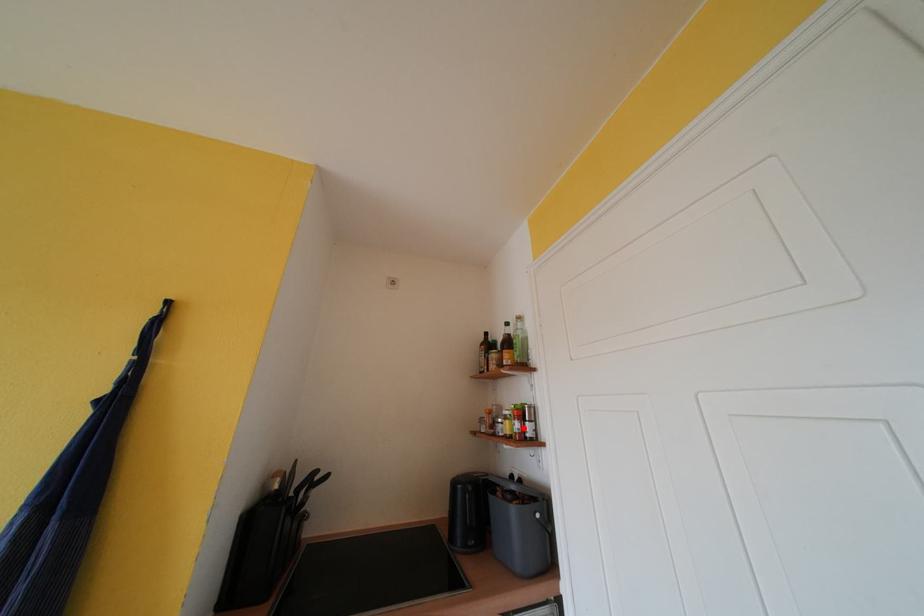
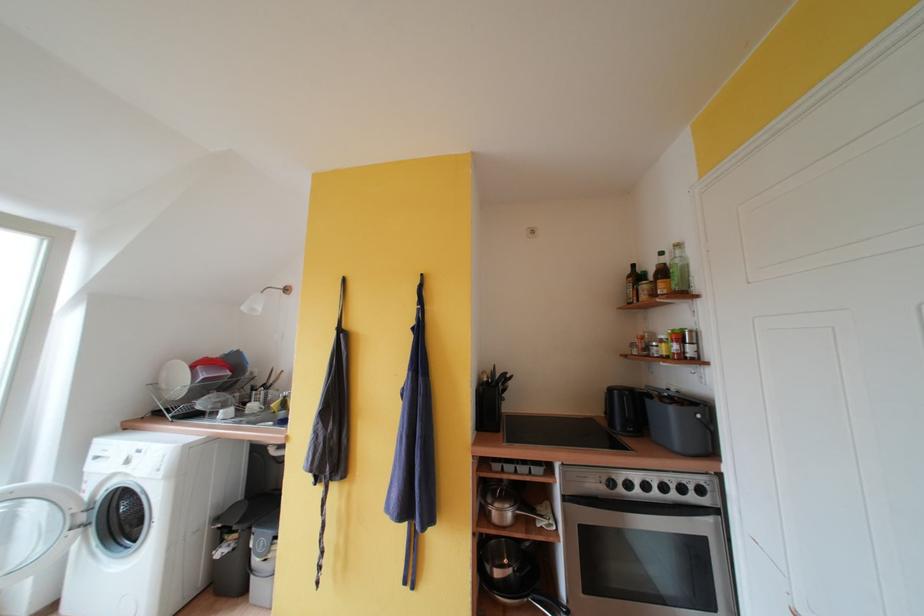
Where in the second image is the point corresponding to the highlighted location from the first image?

(682, 350)